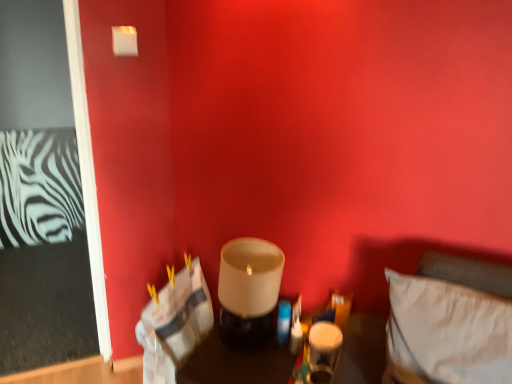
The width and height of the screenshot is (512, 384). What do you see at coordinates (446, 333) in the screenshot? I see `white fabric pillow at lower right` at bounding box center [446, 333].

I want to click on matte white glass at center, marked as the second candle holder in a right-to-left arrangement, so point(249,290).

The width and height of the screenshot is (512, 384). Identify the location of matte white glass at lower center, marked as the second candle holder in a left-to-right arrangement. (323, 350).

Would you say matte white glass at lower center, marked as the second candle holder in a left-to-right arrangement, is inside or outside translucent glass candle holder at center?

matte white glass at lower center, marked as the second candle holder in a left-to-right arrangement, is not inside translucent glass candle holder at center, it's outside.

In terms of width, does matte white glass at lower center, marked as the second candle holder in a left-to-right arrangement, look wider or thinner when compared to translucent glass candle holder at center?

Clearly, matte white glass at lower center, marked as the second candle holder in a left-to-right arrangement, has less width compared to translucent glass candle holder at center.

Based on the photo, which is more to the left, matte white glass at lower center, the first candle holder in the right-to-left sequence, or translucent glass candle holder at center?

Positioned to the left is translucent glass candle holder at center.

At what (x,y) coordinates should I click in order to perform the action: click on the 1st candle holder above the translucent glass candle holder at center (from the image's perspective). Please return your answer as a coordinate pair (x, y). The image size is (512, 384). Looking at the image, I should click on click(323, 350).

Which of these two, matte white glass at lower center, the first candle holder in the right-to-left sequence, or white fabric pillow at lower right, is bigger?

white fabric pillow at lower right.

Is matte white glass at lower center, the first candle holder in the right-to-left sequence, aimed at white fabric pillow at lower right?

No, matte white glass at lower center, the first candle holder in the right-to-left sequence, does not turn towards white fabric pillow at lower right.

From a real-world perspective, is matte white glass at lower center, marked as the second candle holder in a left-to-right arrangement, located beneath white fabric pillow at lower right?

Indeed, from a real-world perspective, matte white glass at lower center, marked as the second candle holder in a left-to-right arrangement, is positioned beneath white fabric pillow at lower right.

In the scene shown: Could you measure the distance between matte white glass at lower center, marked as the second candle holder in a left-to-right arrangement, and white fabric pillow at lower right?

13.99 inches.

This screenshot has height=384, width=512. In the image, there is a white fabric pillow at lower right. Find the location of `candle holder above it (from the image's perspective)`. candle holder above it (from the image's perspective) is located at coordinates (249, 290).

From the image's perspective, between white fabric pillow at lower right and matte white glass at center, marked as the second candle holder in a right-to-left arrangement, which one is located above?

matte white glass at center, marked as the second candle holder in a right-to-left arrangement, is shown above in the image.

Considering the relative sizes of white fabric pillow at lower right and matte white glass at center, placed as the first candle holder when sorted from left to right, in the image provided, is white fabric pillow at lower right bigger than matte white glass at center, placed as the first candle holder when sorted from left to right,?

Correct, white fabric pillow at lower right is larger in size than matte white glass at center, placed as the first candle holder when sorted from left to right.

From the picture: Is white fabric pillow at lower right positioned with its back to matte white glass at center, placed as the first candle holder when sorted from left to right?

white fabric pillow at lower right does not have its back to matte white glass at center, placed as the first candle holder when sorted from left to right.

Which is in front, point (251, 310) or point (389, 336)?

Point (389, 336)

Is matte white glass at center, placed as the first candle holder when sorted from left to right, not inside white fabric pillow at lower right?

Yes, matte white glass at center, placed as the first candle holder when sorted from left to right, is outside of white fabric pillow at lower right.

Considering the relative sizes of matte white glass at center, placed as the first candle holder when sorted from left to right, and white fabric pillow at lower right in the image provided, is matte white glass at center, placed as the first candle holder when sorted from left to right, thinner than white fabric pillow at lower right?

Indeed, matte white glass at center, placed as the first candle holder when sorted from left to right, has a lesser width compared to white fabric pillow at lower right.

From a real-world perspective, is matte white glass at center, marked as the second candle holder in a right-to-left arrangement, positioned over white fabric pillow at lower right based on gravity?

No, from a real-world perspective, matte white glass at center, marked as the second candle holder in a right-to-left arrangement, is not on top of white fabric pillow at lower right.

How different are the orientations of translucent glass candle holder at center and white fabric pillow at lower right in degrees?

The angle between the facing direction of translucent glass candle holder at center and the facing direction of white fabric pillow at lower right is 2.88 degrees.

Is translucent glass candle holder at center inside the boundaries of white fabric pillow at lower right, or outside?

translucent glass candle holder at center is spatially situated outside white fabric pillow at lower right.

From the image's perspective, is translucent glass candle holder at center located above white fabric pillow at lower right?

No.

Is point (379, 325) positioned in front of point (405, 380)?

No, (379, 325) is further to viewer.

From the picture: Is matte white glass at lower center, marked as the second candle holder in a left-to-right arrangement, at the right side of matte white glass at center, placed as the first candle holder when sorted from left to right?

Yes, matte white glass at lower center, marked as the second candle holder in a left-to-right arrangement, is to the right of matte white glass at center, placed as the first candle holder when sorted from left to right.

Is matte white glass at center, placed as the first candle holder when sorted from left to right, at the back of matte white glass at lower center, marked as the second candle holder in a left-to-right arrangement?

No.

You are a GUI agent. You are given a task and a screenshot of the screen. Output one action in this format:
    pyautogui.click(x=<x>, y=<y>)
    Task: Click on the candle holder on the left of the translucent glass candle holder at center
    The width and height of the screenshot is (512, 384).
    Given the screenshot: What is the action you would take?
    pyautogui.click(x=249, y=290)

Does point (350, 347) come closer to viewer compared to point (256, 258)?

Yes, point (350, 347) is closer to viewer.

How different are the orientations of translucent glass candle holder at center and matte white glass at center, placed as the first candle holder when sorted from left to right, in degrees?

3.29 degrees.

From a real-world perspective, is translucent glass candle holder at center on matte white glass at center, placed as the first candle holder when sorted from left to right?

Actually, translucent glass candle holder at center is physically below matte white glass at center, placed as the first candle holder when sorted from left to right, in the real world.

Find the location of `candle holder on the right of translucent glass candle holder at center`. candle holder on the right of translucent glass candle holder at center is located at coordinates (323, 350).

Where is `pillow above the matte white glass at lower center, marked as the second candle holder in a left-to-right arrangement (from the image's perspective)`? The image size is (512, 384). pillow above the matte white glass at lower center, marked as the second candle holder in a left-to-right arrangement (from the image's perspective) is located at coordinates (446, 333).

Based on their spatial positions, is translucent glass candle holder at center or matte white glass at lower center, the first candle holder in the right-to-left sequence, closer to white fabric pillow at lower right?

Based on the image, matte white glass at lower center, the first candle holder in the right-to-left sequence, appears to be nearer to white fabric pillow at lower right.

Looking at the image, which one is located further to white fabric pillow at lower right, matte white glass at lower center, the first candle holder in the right-to-left sequence, or translucent glass candle holder at center?

The object further to white fabric pillow at lower right is translucent glass candle holder at center.

In the scene shown: Estimate the real-world distances between objects in this image. Which object is further from translucent glass candle holder at center, white fabric pillow at lower right or matte white glass at center, placed as the first candle holder when sorted from left to right?

The object further to translucent glass candle holder at center is white fabric pillow at lower right.

Based on their spatial positions, is translucent glass candle holder at center or white fabric pillow at lower right closer to matte white glass at center, placed as the first candle holder when sorted from left to right?

Among the two, translucent glass candle holder at center is located nearer to matte white glass at center, placed as the first candle holder when sorted from left to right.

Which object lies further to the anchor point white fabric pillow at lower right, matte white glass at center, marked as the second candle holder in a right-to-left arrangement, or matte white glass at lower center, marked as the second candle holder in a left-to-right arrangement?

matte white glass at center, marked as the second candle holder in a right-to-left arrangement.

Looking at the image, which one is located further to matte white glass at center, marked as the second candle holder in a right-to-left arrangement, white fabric pillow at lower right or matte white glass at lower center, marked as the second candle holder in a left-to-right arrangement?

white fabric pillow at lower right lies further to matte white glass at center, marked as the second candle holder in a right-to-left arrangement, than the other object.

Based on their spatial positions, is matte white glass at lower center, the first candle holder in the right-to-left sequence, or white fabric pillow at lower right further from translucent glass candle holder at center?

white fabric pillow at lower right is further to translucent glass candle holder at center.

Looking at the image, which one is located closer to matte white glass at center, placed as the first candle holder when sorted from left to right, translucent glass candle holder at center or matte white glass at lower center, marked as the second candle holder in a left-to-right arrangement?

translucent glass candle holder at center is closer to matte white glass at center, placed as the first candle holder when sorted from left to right.

Locate an element on the screen. The width and height of the screenshot is (512, 384). candle holder positioned between white fabric pillow at lower right and matte white glass at lower center, marked as the second candle holder in a left-to-right arrangement, from near to far is located at coordinates (249, 290).

You are a GUI agent. You are given a task and a screenshot of the screen. Output one action in this format:
    pyautogui.click(x=<x>, y=<y>)
    Task: Click on the candle holder between matte white glass at center, marked as the second candle holder in a right-to-left arrangement, and translucent glass candle holder at center from top to bottom
    
    Given the screenshot: What is the action you would take?
    pyautogui.click(x=323, y=350)

Locate an element on the screen. Image resolution: width=512 pixels, height=384 pixels. furniture located between white fabric pillow at lower right and matte white glass at center, placed as the first candle holder when sorted from left to right, in the depth direction is located at coordinates (236, 364).

You are a GUI agent. You are given a task and a screenshot of the screen. Output one action in this format:
    pyautogui.click(x=<x>, y=<y>)
    Task: Click on the furniture between white fabric pillow at lower right and matte white glass at lower center, the first candle holder in the right-to-left sequence, from front to back
    This screenshot has height=384, width=512.
    Given the screenshot: What is the action you would take?
    pyautogui.click(x=236, y=364)